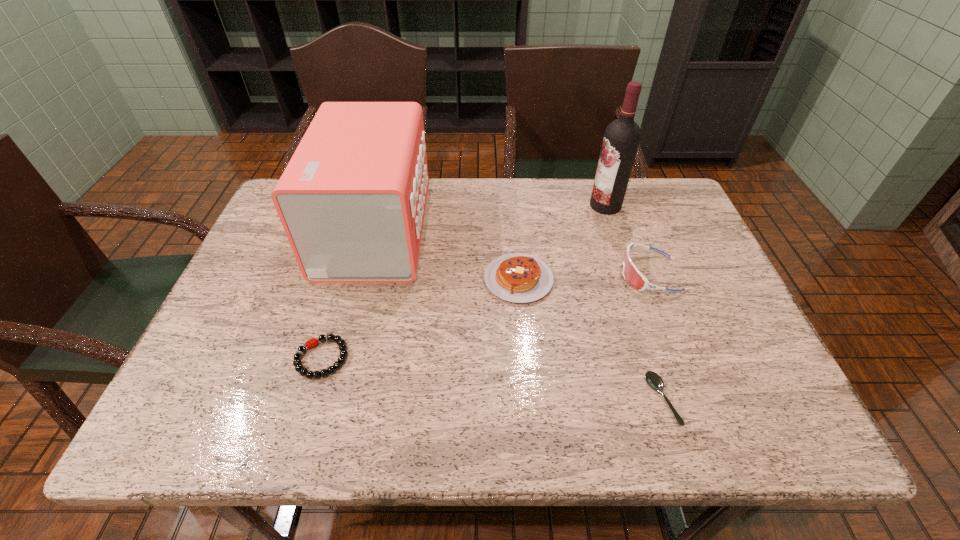
The width and height of the screenshot is (960, 540). I want to click on free point located 0.240m on the surface of the box where the text is embossed, so click(x=513, y=230).

You are a GUI agent. You are given a task and a screenshot of the screen. Output one action in this format:
    pyautogui.click(x=<x>, y=<y>)
    Task: Click on the vacant region located on the front-facing side of the goggles
    This screenshot has width=960, height=540.
    Given the screenshot: What is the action you would take?
    pyautogui.click(x=480, y=274)

At what (x,y) coordinates should I click in order to perform the action: click on vacant space located 0.320m on the front-facing side of the goggles. Please return your answer as a coordinate pair (x, y). Looking at the image, I should click on (492, 274).

At what (x,y) coordinates should I click in order to perform the action: click on blank space located 0.100m on the front-facing side of the goggles. Please return your answer as a coordinate pair (x, y). This screenshot has width=960, height=540. Looking at the image, I should click on (579, 274).

The width and height of the screenshot is (960, 540). I want to click on free location located 0.280m on the right of the pancake, so pos(666,279).

Identify the location of vacant area situated on the back of the bracelet. The height and width of the screenshot is (540, 960). click(342, 290).

The width and height of the screenshot is (960, 540). Find the location of `free space located 0.170m on the right of the soupspoon`. free space located 0.170m on the right of the soupspoon is located at coordinates (760, 400).

I want to click on wine bottle present at the far edge, so click(622, 136).

Locate an element on the screen. box situated at the far edge is located at coordinates (352, 199).

At what (x,y) coordinates should I click in order to perform the action: click on object that is positioned at the near edge. Please return your answer as a coordinate pair (x, y). Looking at the image, I should click on (653, 379).